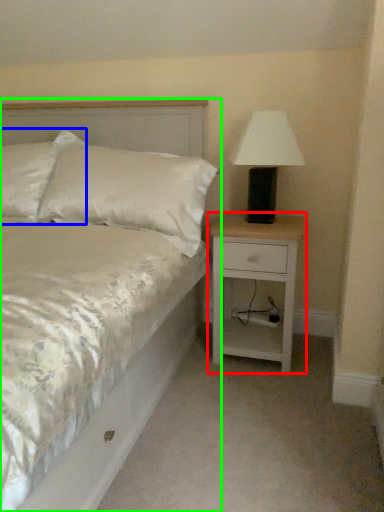
Question: Which object is positioned closest to nightstand (highlighted by a red box)? Select from pillow (highlighted by a blue box) and bed (highlighted by a green box).

Choices:
 (A) pillow
 (B) bed

Answer: (B)